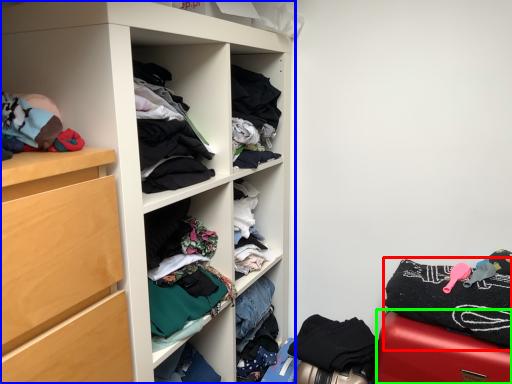
Question: Which object is the farthest from clothing (highlighted by a red box)? Choose among these: cupboard (highlighted by a blue box) or furniture (highlighted by a green box).

Choices:
 (A) cupboard
 (B) furniture

Answer: (A)